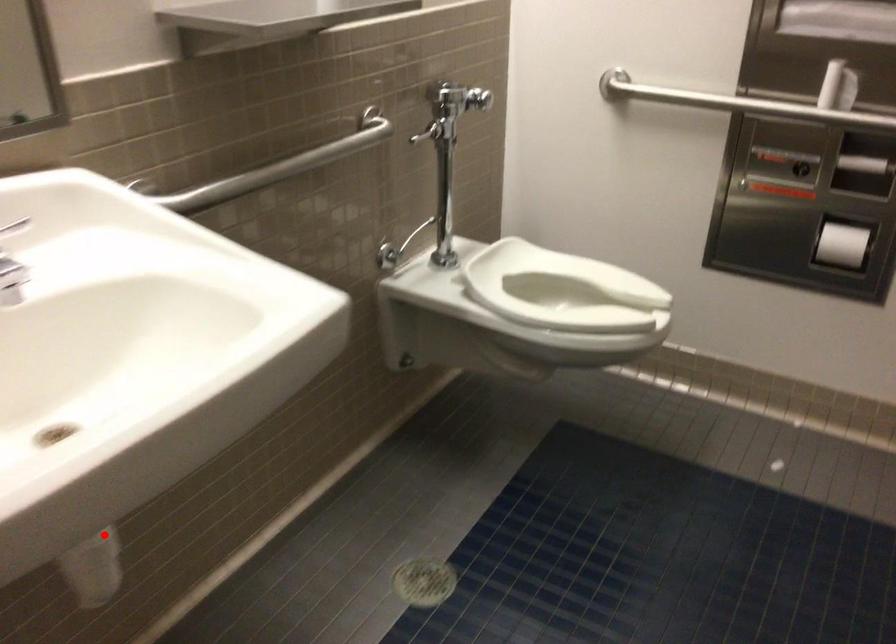
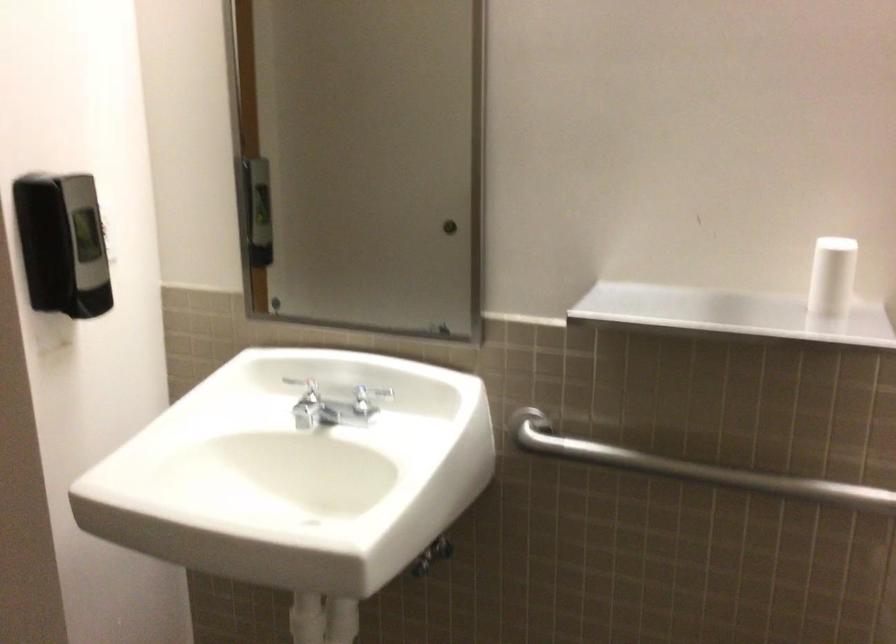
Where in the second image is the point corresponding to the highlighted location from the first image?

(325, 623)